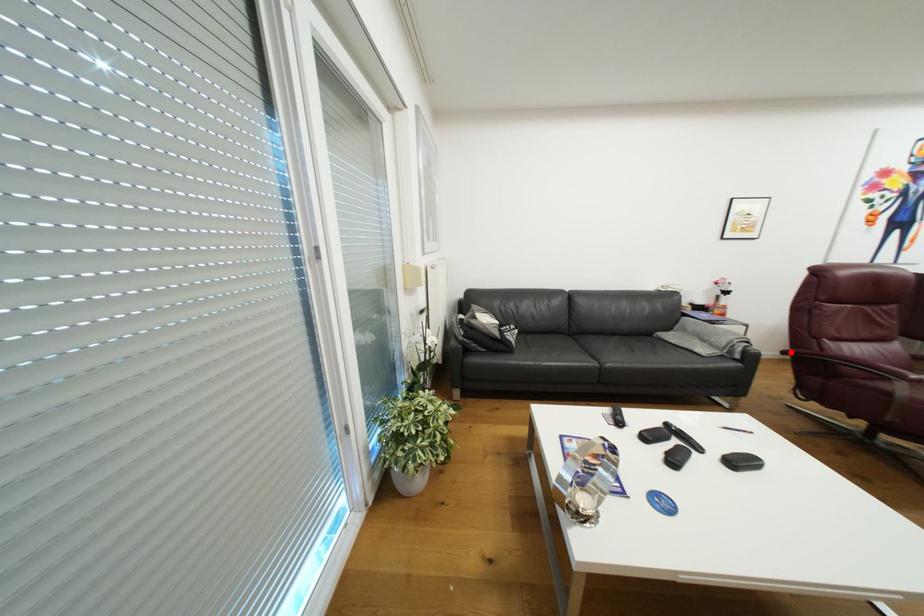
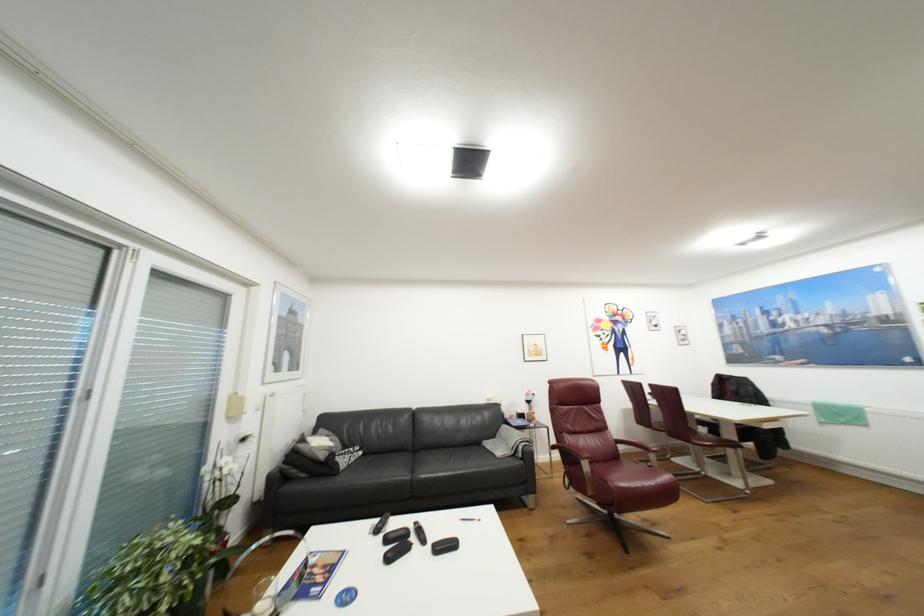
Question: I am providing you with two images of the same scene from different viewpoints. Given a red point in image1, look at the same physical point in image2. Is it:

Choices:
 (A) Closer to the viewpoint
 (B) Farther from the viewpoint

Answer: (B)